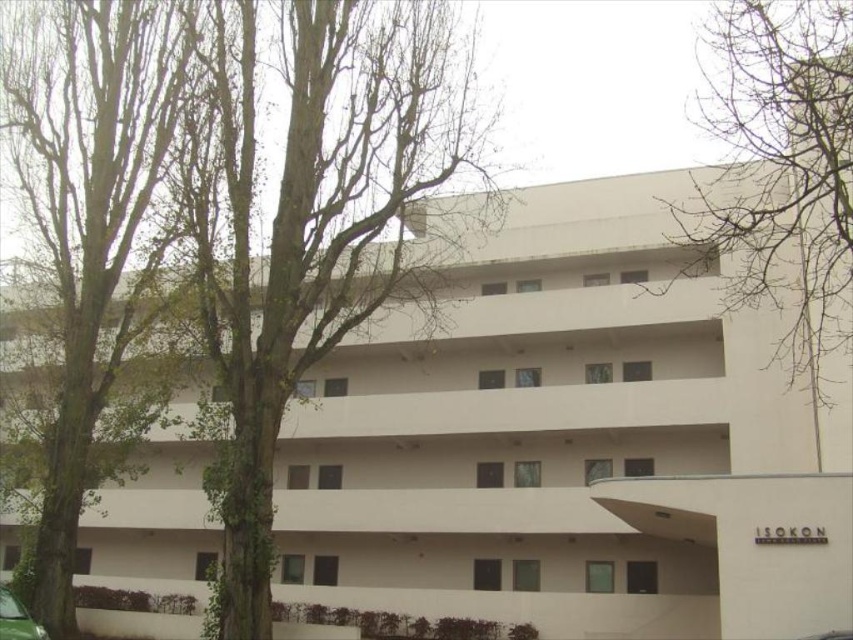
Based on the photo, can you confirm if green leafy tree at left is wider than bare branches at upper right?

No.

Looking at this image, can you confirm if green leafy tree at left is positioned above bare branches at upper right?

Incorrect, green leafy tree at left is not positioned above bare branches at upper right.

Between point (254, 467) and point (807, 342), which one is positioned behind?

Positioned behind is point (807, 342).

You are a GUI agent. You are given a task and a screenshot of the screen. Output one action in this format:
    pyautogui.click(x=<x>, y=<y>)
    Task: Click on the green leafy tree at left
    
    Given the screenshot: What is the action you would take?
    pyautogui.click(x=308, y=225)

Does point (764, 292) come behind point (12, 620)?

Yes, point (764, 292) is behind point (12, 620).

Does bare branches at upper right have a lesser width compared to green matte car at lower left?

In fact, bare branches at upper right might be wider than green matte car at lower left.

Measure the distance between point (730,29) and camera.

The distance of point (730,29) from camera is 58.20 feet.

Image resolution: width=853 pixels, height=640 pixels. Find the location of `bare branches at upper right`. bare branches at upper right is located at coordinates (781, 164).

Measure the distance between green leafy tree at left and green matte car at lower left.

green leafy tree at left is 30.89 feet from green matte car at lower left.

Is green leafy tree at left to the right of green matte car at lower left from the viewer's perspective?

Yes, green leafy tree at left is to the right of green matte car at lower left.

Who is more distant from viewer, (424, 97) or (12, 616)?

The point (424, 97) is more distant.

Image resolution: width=853 pixels, height=640 pixels. In order to click on green leafy tree at left in this screenshot , I will do `click(308, 225)`.